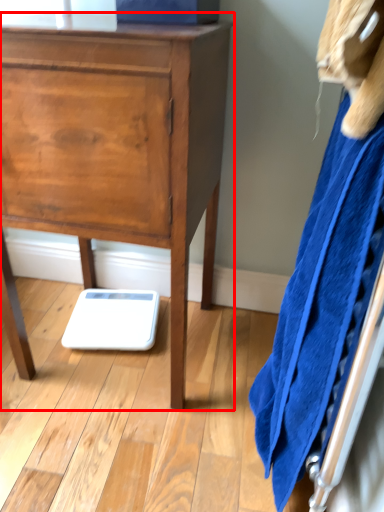
Question: From the image's perspective, where is chest of drawers (annotated by the red box) located in relation to bath towel in the image?

Choices:
 (A) above
 (B) below

Answer: (A)